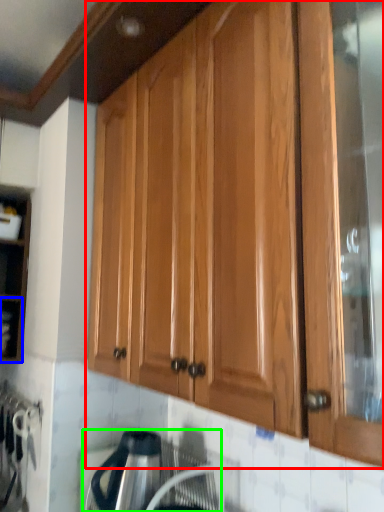
Question: Which is farther away from cabinetry (highlighted by a red box)? shelf (highlighted by a blue box) or appliance (highlighted by a green box)?

Choices:
 (A) shelf
 (B) appliance

Answer: (A)